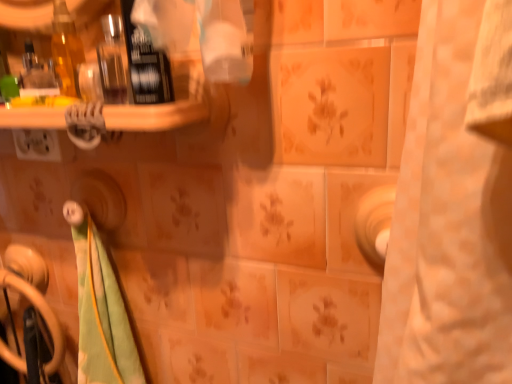
Question: Is white plastic toothbrushes at upper left to the right of black plastic door handle at lower left from the viewer's perspective?

Choices:
 (A) yes
 (B) no

Answer: (A)

Question: Is white plastic toothbrushes at upper left in contact with black plastic door handle at lower left?

Choices:
 (A) yes
 (B) no

Answer: (B)

Question: Considering the relative sizes of white plastic toothbrushes at upper left and black plastic door handle at lower left in the image provided, is white plastic toothbrushes at upper left wider than black plastic door handle at lower left?

Choices:
 (A) yes
 (B) no

Answer: (A)

Question: From a real-world perspective, is white plastic toothbrushes at upper left over black plastic door handle at lower left?

Choices:
 (A) no
 (B) yes

Answer: (B)

Question: Does white plastic toothbrushes at upper left have a lesser height compared to black plastic door handle at lower left?

Choices:
 (A) yes
 (B) no

Answer: (A)

Question: Is white plastic toothbrushes at upper left taller than black plastic door handle at lower left?

Choices:
 (A) no
 (B) yes

Answer: (A)

Question: Does black plastic door handle at lower left contain white plastic toothbrushes at upper left?

Choices:
 (A) no
 (B) yes

Answer: (A)

Question: Does black plastic door handle at lower left appear on the left side of white plastic toothbrushes at upper left?

Choices:
 (A) no
 (B) yes

Answer: (B)

Question: Considering the relative sizes of black plastic door handle at lower left and white plastic toothbrushes at upper left in the image provided, is black plastic door handle at lower left bigger than white plastic toothbrushes at upper left?

Choices:
 (A) no
 (B) yes

Answer: (B)

Question: Considering the relative sizes of black plastic door handle at lower left and white plastic toothbrushes at upper left in the image provided, is black plastic door handle at lower left taller than white plastic toothbrushes at upper left?

Choices:
 (A) no
 (B) yes

Answer: (B)

Question: From the image's perspective, is black plastic door handle at lower left above white plastic toothbrushes at upper left?

Choices:
 (A) no
 (B) yes

Answer: (A)

Question: Can you confirm if black plastic door handle at lower left is wider than white plastic toothbrushes at upper left?

Choices:
 (A) yes
 (B) no

Answer: (B)

Question: From their relative heights in the image, would you say black plastic door handle at lower left is taller or shorter than white plastic toothbrushes at upper left?

Choices:
 (A) short
 (B) tall

Answer: (B)